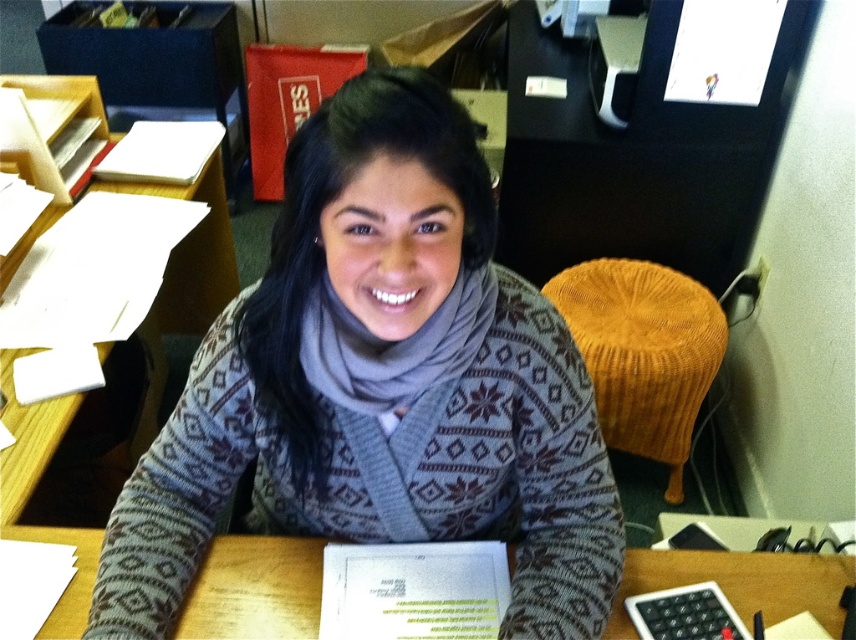
Question: Is gray knitted sweater at center below orange knitted stool at right?

Choices:
 (A) no
 (B) yes

Answer: (A)

Question: Does gray knitted sweater at center appear over wooden table at center?

Choices:
 (A) yes
 (B) no

Answer: (A)

Question: Can you confirm if gray knitted sweater at center is bigger than orange knitted stool at right?

Choices:
 (A) no
 (B) yes

Answer: (B)

Question: Which object appears farthest from the camera in this image?

Choices:
 (A) orange knitted stool at right
 (B) gray knitted sweater at center

Answer: (A)

Question: Which object is closer to the camera taking this photo?

Choices:
 (A) wooden table at center
 (B) orange knitted stool at right

Answer: (A)

Question: Which point is farther to the camera?

Choices:
 (A) (191, 618)
 (B) (354, 184)
 (C) (602, 330)

Answer: (C)